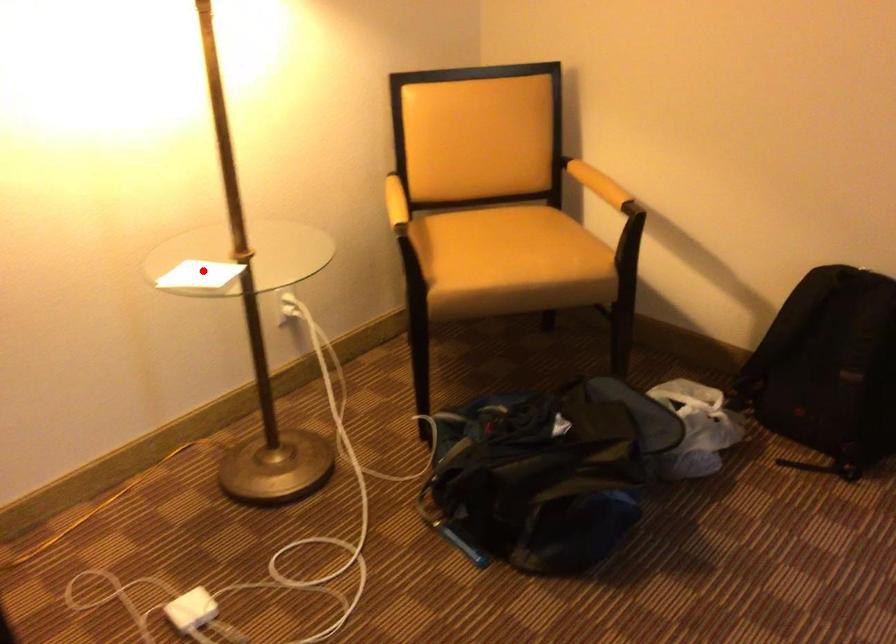
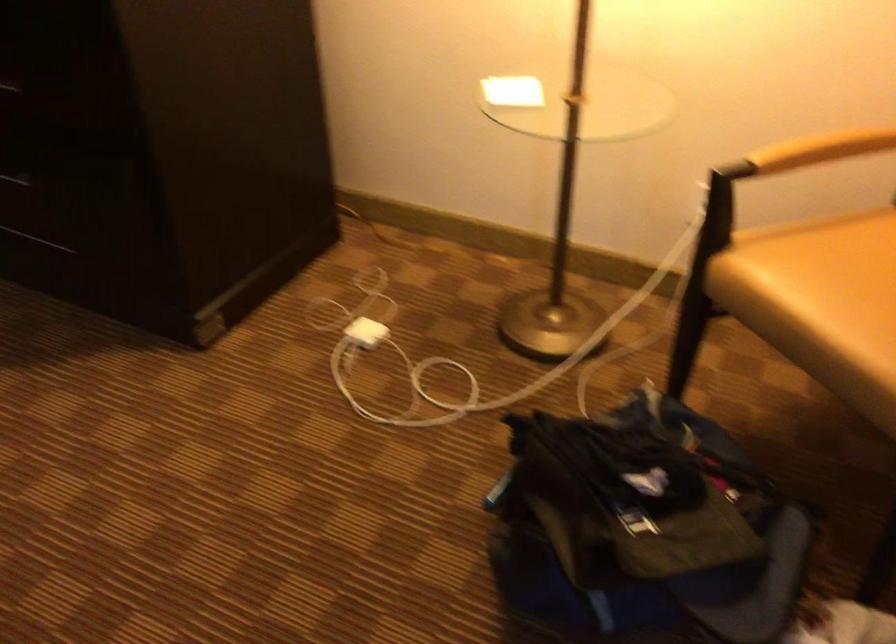
Find the pixel in the second image that matches the highlighted location in the first image.

(513, 91)